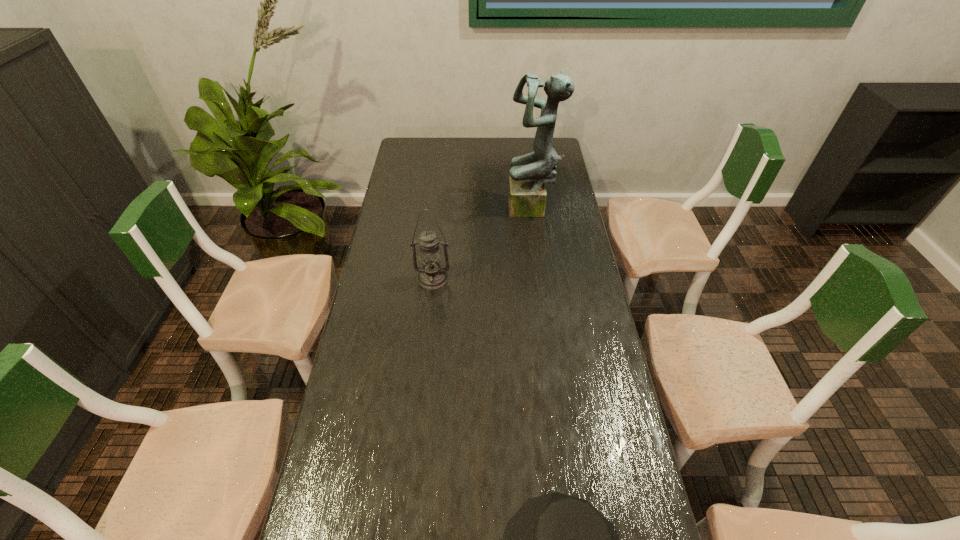
Where is `free point that satisfies the following two spatial constraints: 1. on the face of the tallest object; 2. on the front side of the leftmost object`? free point that satisfies the following two spatial constraints: 1. on the face of the tallest object; 2. on the front side of the leftmost object is located at coordinates (541, 279).